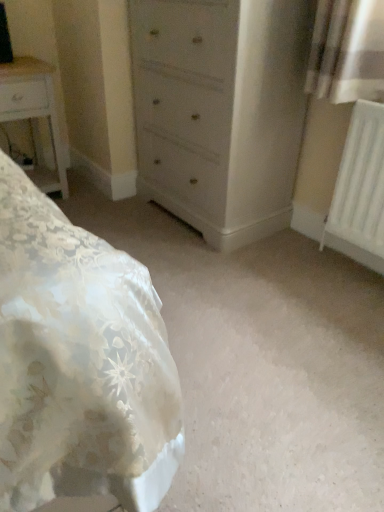
Find the location of `free spot in front of light gray wood chest of drawers at center`. free spot in front of light gray wood chest of drawers at center is located at coordinates (240, 275).